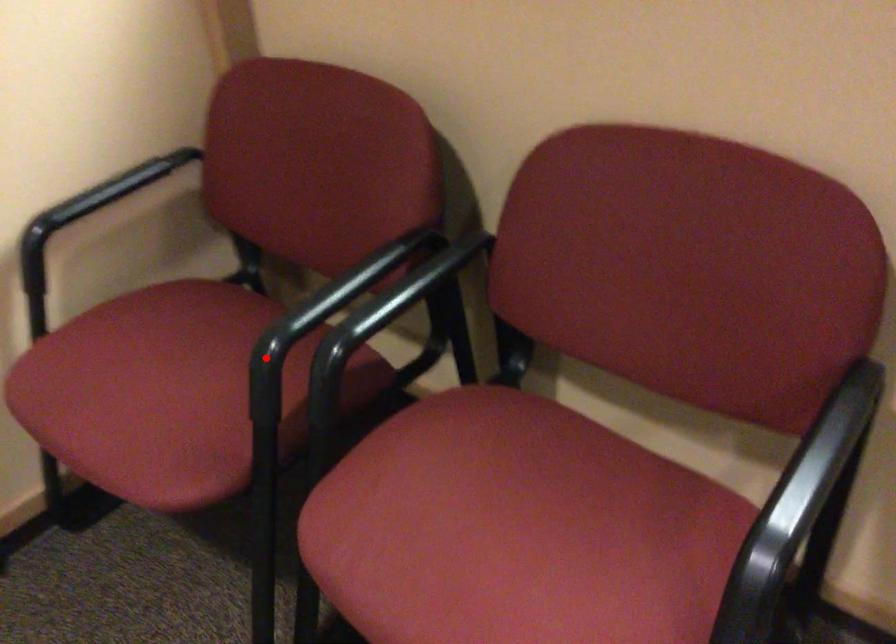
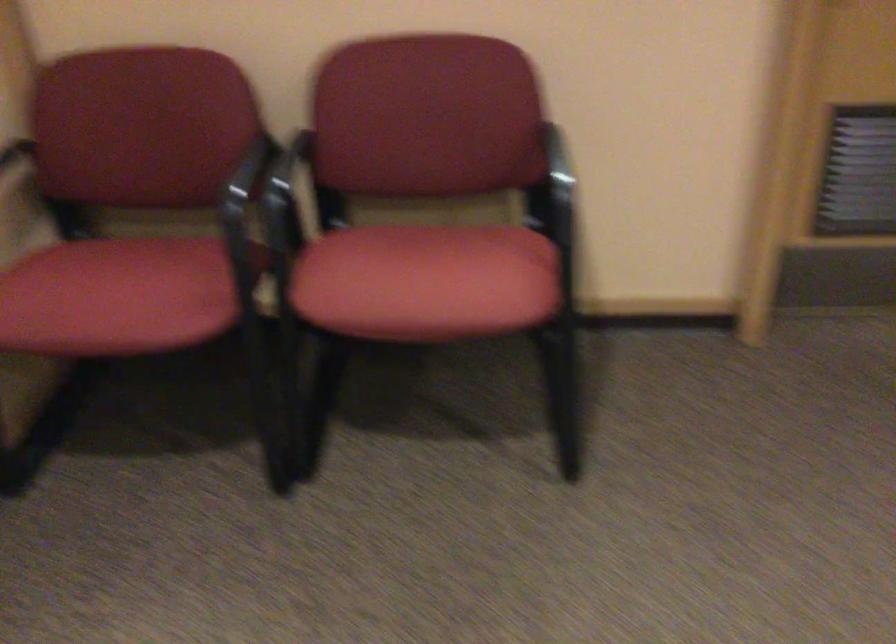
Question: I am providing you with two images of the same scene from different viewpoints. Given a red point in image1, look at the same physical point in image2. Is it:

Choices:
 (A) Closer to the viewpoint
 (B) Farther from the viewpoint

Answer: (B)